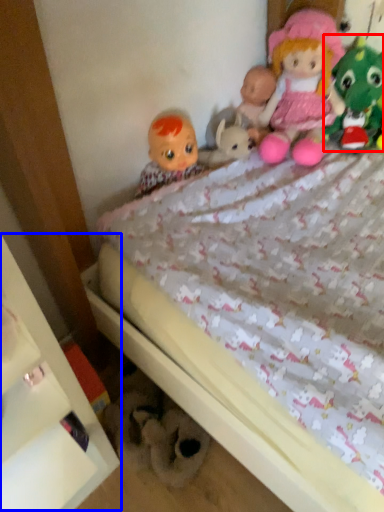
Question: Which object appears closest to the camera in this image, toy (highlighted by a red box) or shelf (highlighted by a blue box)?

Choices:
 (A) toy
 (B) shelf

Answer: (B)